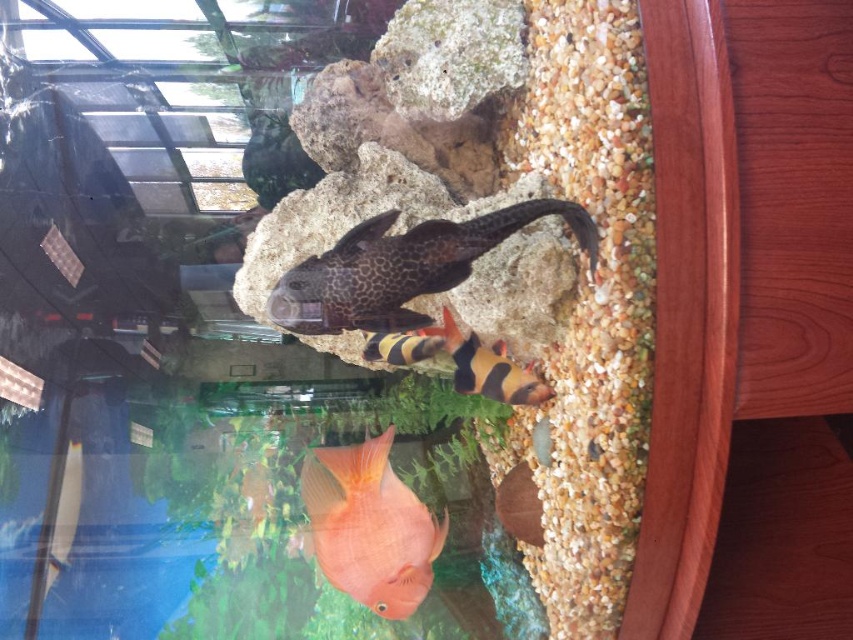
You are a small aquatic creature swimming in the fish tank. You want to hide behind the leopard print rock at center and the orange matte goldfish at center. Which object would allow you to hide more effectively based on their sizes?

The leopard print rock at center has a lesser height compared to orange matte goldfish at center, so the orange matte goldfish at center is taller and would provide better hiding coverage.

You are an underwater explorer looking at the fish tank. You see two points marked in the image. Which point is closer to you, point (x=412, y=292) or point (x=488, y=364)?

Point (x=412, y=292) is in front of point (x=488, y=364), so it is closer to you.

You are a small aquatic creature swimming in the fish tank. You want to reach the orange matte goldfish at center from the leopard print rock at center. Which direction should you swim to get closer to the goldfish?

You should swim backward because the leopard print rock at center is closer to you than the orange matte goldfish at center, so moving away from the rock will bring you toward the goldfish.